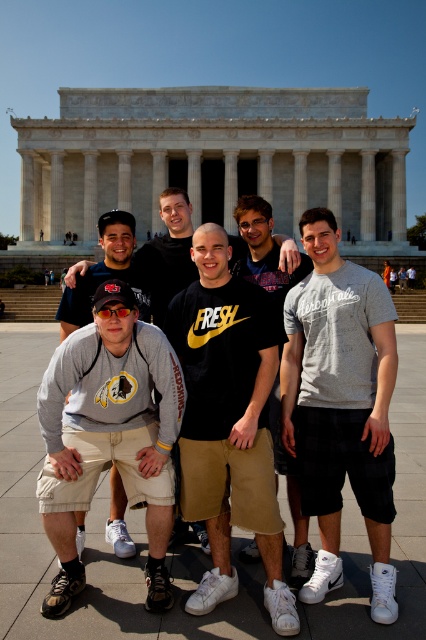
Question: Which point is farther from the camera taking this photo?

Choices:
 (A) (319, 557)
 (B) (85, 298)

Answer: (B)

Question: Does gray heathered t-shirt at center appear on the left side of gray fabric skateboard at lower left?

Choices:
 (A) yes
 (B) no

Answer: (B)

Question: Among these objects, which one is nearest to the camera?

Choices:
 (A) gray heathered t-shirt at center
 (B) black matte t-shirt at center
 (C) gray cotton sweatshirt at center
 (D) gray cotton hoodie at lower left

Answer: (B)

Question: Does gray heathered t-shirt at center have a larger size compared to gray fabric skateboard at lower left?

Choices:
 (A) yes
 (B) no

Answer: (A)

Question: Is gray heathered t-shirt at center to the left of gray fabric skateboard at lower left from the viewer's perspective?

Choices:
 (A) yes
 (B) no

Answer: (B)

Question: Which object appears closest to the camera in this image?

Choices:
 (A) matte black shirt at center
 (B) black matte t-shirt at center
 (C) gray cotton hoodie at lower left
 (D) gray cotton sweatshirt at center

Answer: (B)